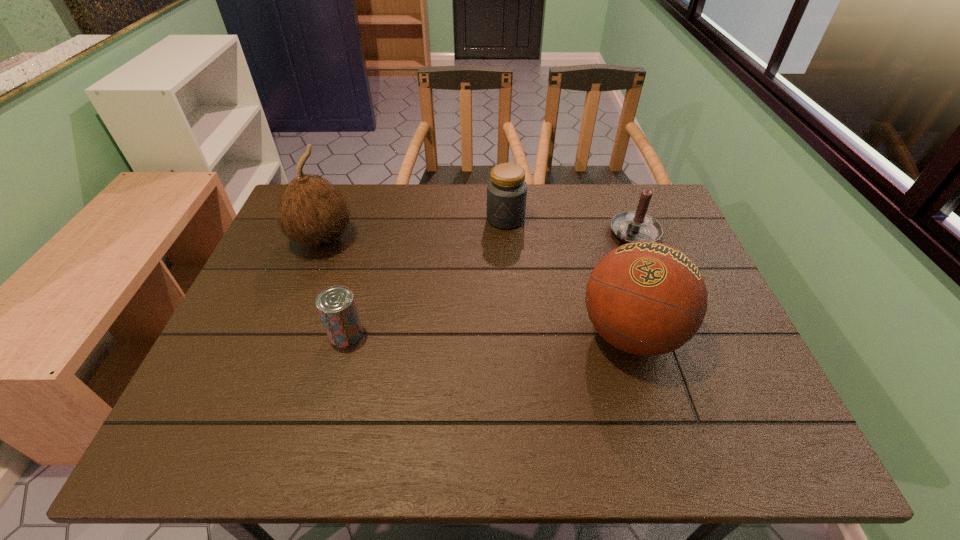
Identify the location of vacant region located on the surface of the coconut. Image resolution: width=960 pixels, height=540 pixels. (400, 280).

Locate an element on the screen. The image size is (960, 540). free point located 0.220m on the surface of the third object from right to left near the warning symbol is located at coordinates (479, 280).

You are a GUI agent. You are given a task and a screenshot of the screen. Output one action in this format:
    pyautogui.click(x=<x>, y=<y>)
    Task: Click on the free spot located 0.310m on the surface of the third object from right to left near the warning symbol
    The height and width of the screenshot is (540, 960).
    Given the screenshot: What is the action you would take?
    pyautogui.click(x=468, y=305)

Where is `free space located 0.370m on the surface of the third object from right to left near the warning symbol`? This screenshot has height=540, width=960. free space located 0.370m on the surface of the third object from right to left near the warning symbol is located at coordinates (461, 323).

Locate an element on the screen. The image size is (960, 540). vacant region located on the side of the candle with the handle loop is located at coordinates (522, 310).

The height and width of the screenshot is (540, 960). I want to click on vacant space located on the side of the candle with the handle loop, so click(573, 275).

Locate an element on the screen. This screenshot has width=960, height=540. free spot located 0.130m on the side of the candle with the handle loop is located at coordinates (590, 264).

The image size is (960, 540). Find the location of `coconut that is at the far edge`. coconut that is at the far edge is located at coordinates (311, 210).

The height and width of the screenshot is (540, 960). Find the location of `jar present at the far edge`. jar present at the far edge is located at coordinates 506,190.

Identify the location of candle present at the far edge. (634, 226).